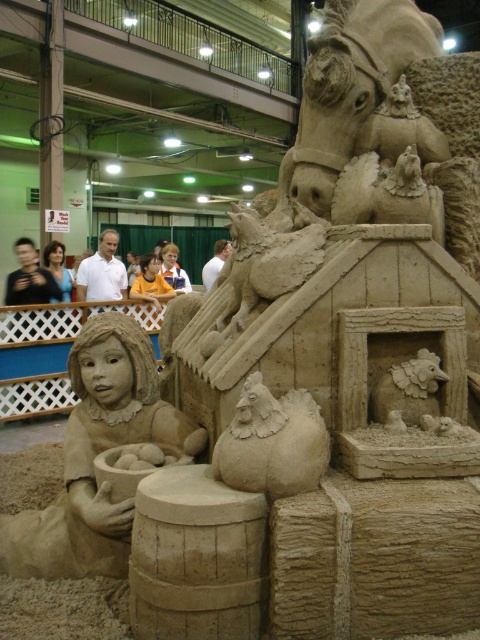
You are standing in front of the sand sculpture and want to touch the two points marked on it. Which point, point [127,333] or point [56,252], is closer to you?

Point [127,333] is closer to the viewer than point [56,252].